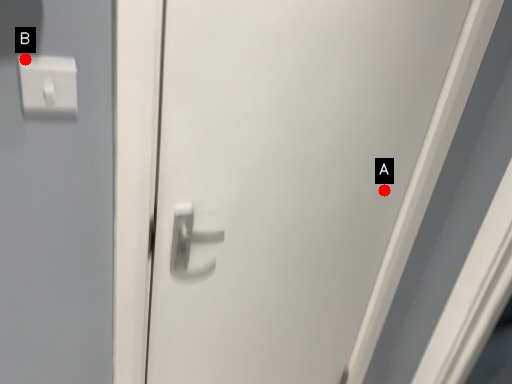
Question: Two points are circled on the image, labeled by A and B beside each circle. Which point appears closest to the camera in this image?

Choices:
 (A) A is closer
 (B) B is closer

Answer: (B)